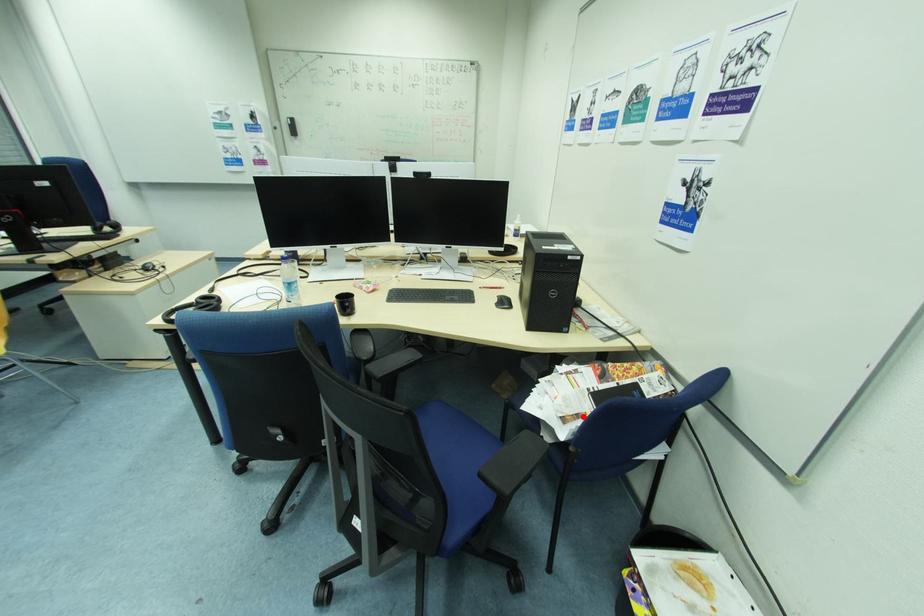
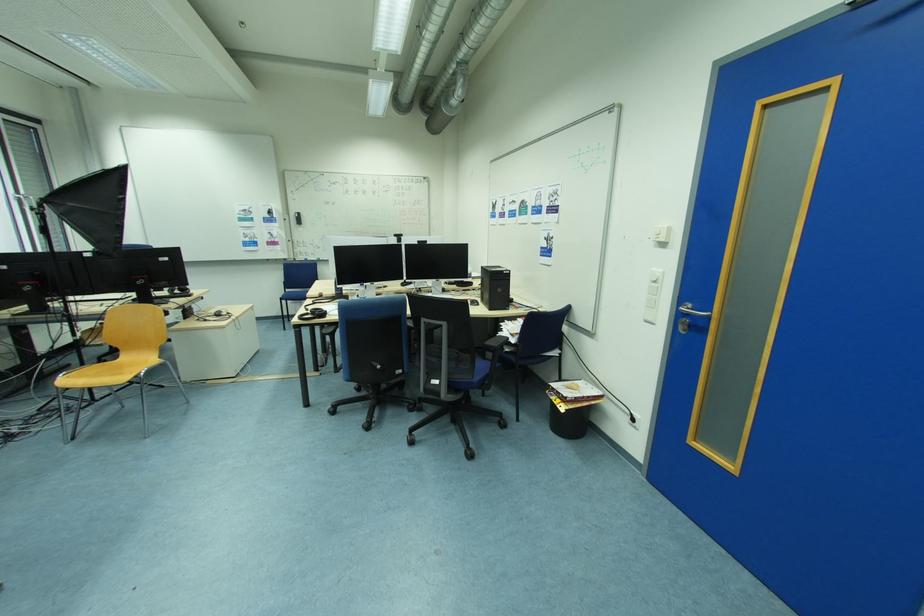
Locate, in the second image, the point that corresponds to the highlighted location in the first image.

(525, 334)